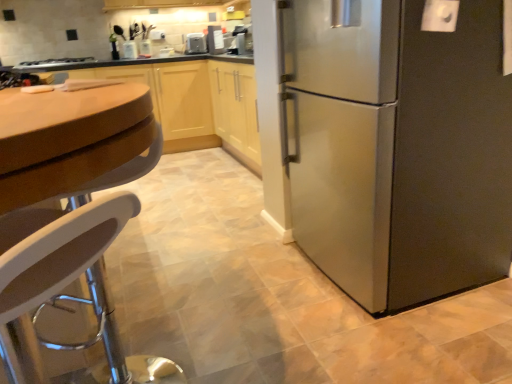
The height and width of the screenshot is (384, 512). What are the coordinates of `white plastic stool at lower left` in the screenshot? It's located at (53, 257).

You are a GUI agent. You are given a task and a screenshot of the screen. Output one action in this format:
    pyautogui.click(x=<x>, y=<y>)
    Task: Click on the satin silver refrigerator at right
    
    Given the screenshot: What is the action you would take?
    pyautogui.click(x=392, y=141)

Where is `satin silver stove at upper left`? The image size is (512, 384). satin silver stove at upper left is located at coordinates (53, 62).

Find the location of `satin black coffee maker at upper center, which appears as the 1th appliance when viewed from the front`. satin black coffee maker at upper center, which appears as the 1th appliance when viewed from the front is located at coordinates (215, 40).

The height and width of the screenshot is (384, 512). What are the coordinates of `wooden cabinet at center` in the screenshot? It's located at (191, 99).

Consider the image. How far apart are wooden cabinet at center and satin silver stove at upper left?

wooden cabinet at center is 3.46 feet away from satin silver stove at upper left.

Does point (170, 139) come in front of point (26, 67)?

No, it is behind (26, 67).

Are wooden cabinet at center and satin silver stove at upper left far apart?

Yes, wooden cabinet at center and satin silver stove at upper left are quite far apart.

From the image's perspective, does wooden cabinet at center appear lower than satin silver stove at upper left?

Indeed, from the image's perspective, wooden cabinet at center is shown beneath satin silver stove at upper left.

Which is correct: satin silver refrigerator at right is inside wooden cabinet at center, or outside of it?

satin silver refrigerator at right cannot be found inside wooden cabinet at center.

Who is more distant, satin silver refrigerator at right or wooden cabinet at center?

wooden cabinet at center.

Does point (307, 197) lie behind point (255, 91)?

No, (307, 197) is in front of (255, 91).

From a real-world perspective, does satin silver refrigerator at right sit lower than wooden cabinet at center?

No, from a real-world perspective, satin silver refrigerator at right is not under wooden cabinet at center.

Who is bigger, white plastic stool at lower left or metallic silver toaster at upper center, placed as the second appliance when sorted from right to left?

white plastic stool at lower left.

Is white plastic stool at lower left positioned behind metallic silver toaster at upper center, arranged as the first appliance when viewed from the back?

No.

Where is `the 2nd appliance behind the white plastic stool at lower left, counting from the anchor's position`? the 2nd appliance behind the white plastic stool at lower left, counting from the anchor's position is located at coordinates (196, 43).

In terms of width, does satin silver stove at upper left look wider or thinner when compared to wooden cabinet at center?

In the image, satin silver stove at upper left appears to be more narrow than wooden cabinet at center.

Is satin silver stove at upper left spatially inside wooden cabinet at center, or outside of it?

satin silver stove at upper left cannot be found inside wooden cabinet at center.

From the image's perspective, is metallic silver toaster at upper center, placed as the second appliance when sorted from right to left, located above or below satin silver refrigerator at right?

Based on their image positions, metallic silver toaster at upper center, placed as the second appliance when sorted from right to left, is located above satin silver refrigerator at right.

In the scene shown: Is metallic silver toaster at upper center, the second appliance positioned from the front, aimed at satin silver refrigerator at right?

Yes, metallic silver toaster at upper center, the second appliance positioned from the front, faces towards satin silver refrigerator at right.

Consider the image. Which is further, (187, 51) or (466, 128)?

The point (187, 51) is behind.

Which appliance is the 2nd one when counting from the left side of the satin silver refrigerator at right? Please provide its 2D coordinates.

[(196, 43)]

Who is taller, white plastic stool at lower left or wooden cabinet at center?

Standing taller between the two is wooden cabinet at center.

Is white plastic stool at lower left far from wooden cabinet at center?

Yes, white plastic stool at lower left is far from wooden cabinet at center.

Could you tell me if white plastic stool at lower left is facing wooden cabinet at center?

No, white plastic stool at lower left is not turned towards wooden cabinet at center.

Does white plastic stool at lower left appear on the left side of wooden cabinet at center?

In fact, white plastic stool at lower left is to the right of wooden cabinet at center.

Is satin black coffee maker at upper center, which is counted as the 2th appliance, starting from the left, oriented away from metallic silver toaster at upper center, placed as the second appliance when sorted from right to left?

No, satin black coffee maker at upper center, which is counted as the 2th appliance, starting from the left, is not facing the opposite direction of metallic silver toaster at upper center, placed as the second appliance when sorted from right to left.

Do you think satin black coffee maker at upper center, the 2th appliance in the back-to-front sequence, is within metallic silver toaster at upper center, placed as the second appliance when sorted from right to left, or outside of it?

satin black coffee maker at upper center, the 2th appliance in the back-to-front sequence, is not inside metallic silver toaster at upper center, placed as the second appliance when sorted from right to left, it's outside.

Does satin black coffee maker at upper center, which appears as the 1th appliance when viewed from the front, have a greater width compared to metallic silver toaster at upper center, placed as the second appliance when sorted from right to left?

In fact, satin black coffee maker at upper center, which appears as the 1th appliance when viewed from the front, might be narrower than metallic silver toaster at upper center, placed as the second appliance when sorted from right to left.

Locate an element on the screen. cabinetry on the right of satin silver stove at upper left is located at coordinates (191, 99).

Where is `refrigerator above the wooden cabinet at center (from a real-world perspective)`? Image resolution: width=512 pixels, height=384 pixels. refrigerator above the wooden cabinet at center (from a real-world perspective) is located at coordinates (392, 141).

Looking at the image, which one is located closer to satin silver refrigerator at right, metallic silver toaster at upper center, placed as the second appliance when sorted from right to left, or wooden cabinet at center?

wooden cabinet at center is positioned closer to the anchor satin silver refrigerator at right.

Looking at the image, which one is located further to satin silver stove at upper left, wooden cabinet at center or white plastic stool at lower left?

white plastic stool at lower left is further to satin silver stove at upper left.

Estimate the real-world distances between objects in this image. Which object is further from white plastic stool at lower left, metallic silver toaster at upper center, positioned as the 1th appliance in left-to-right order, or wooden cabinet at center?

metallic silver toaster at upper center, positioned as the 1th appliance in left-to-right order, lies further to white plastic stool at lower left than the other object.

Looking at the image, which one is located further to satin silver stove at upper left, wooden cabinet at center or satin silver refrigerator at right?

satin silver refrigerator at right is positioned further to the anchor satin silver stove at upper left.

Considering their positions, is metallic silver toaster at upper center, positioned as the 1th appliance in left-to-right order, positioned further to white plastic stool at lower left than satin black coffee maker at upper center, the first appliance positioned from the right?

metallic silver toaster at upper center, positioned as the 1th appliance in left-to-right order, is positioned further to the anchor white plastic stool at lower left.

Which object lies nearer to the anchor point wooden cabinet at center, satin silver stove at upper left or white plastic stool at lower left?

satin silver stove at upper left is closer to wooden cabinet at center.

Looking at the image, which one is located further to wooden cabinet at center, satin black coffee maker at upper center, the 2th appliance in the back-to-front sequence, or white plastic stool at lower left?

Based on the image, white plastic stool at lower left appears to be further to wooden cabinet at center.

Which object lies further to the anchor point metallic silver toaster at upper center, placed as the second appliance when sorted from right to left, satin black coffee maker at upper center, the 2th appliance in the back-to-front sequence, or satin silver refrigerator at right?

satin silver refrigerator at right is further to metallic silver toaster at upper center, placed as the second appliance when sorted from right to left.

Locate an element on the screen. The height and width of the screenshot is (384, 512). refrigerator between white plastic stool at lower left and metallic silver toaster at upper center, placed as the second appliance when sorted from right to left, from front to back is located at coordinates (392, 141).

Where is `cabinetry between white plastic stool at lower left and metallic silver toaster at upper center, placed as the second appliance when sorted from right to left, in the front-back direction`? This screenshot has width=512, height=384. cabinetry between white plastic stool at lower left and metallic silver toaster at upper center, placed as the second appliance when sorted from right to left, in the front-back direction is located at coordinates (191, 99).

Locate an element on the screen. The width and height of the screenshot is (512, 384). cabinetry between satin silver refrigerator at right and metallic silver toaster at upper center, arranged as the first appliance when viewed from the back, along the z-axis is located at coordinates (191, 99).

Locate an element on the screen. The width and height of the screenshot is (512, 384). appliance between satin silver stove at upper left and satin black coffee maker at upper center, the 2th appliance in the back-to-front sequence is located at coordinates (196, 43).